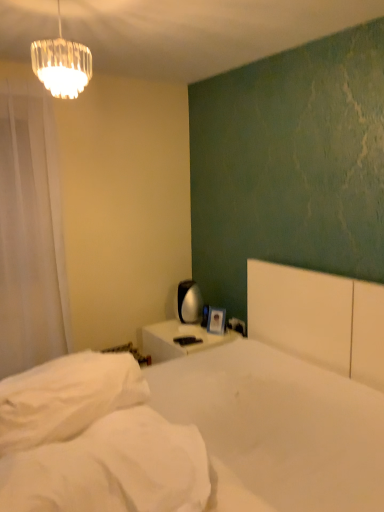
This screenshot has height=512, width=384. Describe the element at coordinates (179, 336) in the screenshot. I see `white glossy nightstand at center` at that location.

The width and height of the screenshot is (384, 512). I want to click on white plastic electric outlet at upper right, so click(x=237, y=326).

Identify the location of white matte bed at center. (190, 435).

Which object is closer to the camera taking this photo, white plastic electric outlet at upper right or white soft pillow at lower left?

Positioned in front is white soft pillow at lower left.

Consider the image. Considering the sizes of white plastic electric outlet at upper right and white soft pillow at lower left in the image, is white plastic electric outlet at upper right taller or shorter than white soft pillow at lower left?

In the image, white plastic electric outlet at upper right appears to be shorter than white soft pillow at lower left.

From a real-world perspective, is white plastic electric outlet at upper right physically located above or below white soft pillow at lower left?

In terms of real-world spatial position, white plastic electric outlet at upper right is below white soft pillow at lower left.

At what (x,y) coordinates should I click in order to perform the action: click on electric outlet that appears behind the white soft pillow at lower left. Please return your answer as a coordinate pair (x, y). Looking at the image, I should click on point(237,326).

Locate an element on the screen. mattress above the white glossy nightstand at center (from the image's perspective) is located at coordinates (94, 441).

Based on their sizes in the image, would you say white soft mattress at lower left is bigger or smaller than white glossy nightstand at center?

Considering their sizes, white soft mattress at lower left takes up less space than white glossy nightstand at center.

Between point (120, 404) and point (210, 343), which one is positioned in front?

Point (120, 404)

Considering the relative positions of white soft mattress at lower left and white glossy nightstand at center in the image provided, is white soft mattress at lower left to the left or to the right of white glossy nightstand at center?

Clearly, white soft mattress at lower left is on the left of white glossy nightstand at center in the image.

Is white sheer curtain at left oriented away from white matte bed at center?

No, white matte bed at center is not at the back of white sheer curtain at left.

Is white sheer curtain at left not near white matte bed at center?

Yes.

Consider the image. Is white sheer curtain at left surrounding white matte bed at center?

No.

Find the location of a particular element. This screenshot has width=384, height=512. curtain above the white matte bed at center (from a real-world perspective) is located at coordinates (30, 232).

The width and height of the screenshot is (384, 512). What are the coordinates of `lamp in front of the white sheer curtain at left` in the screenshot? It's located at [61, 64].

Relative to clear glass chandelier at upper left, is white sheer curtain at left in front or behind?

white sheer curtain at left is behind clear glass chandelier at upper left.

From a real-world perspective, who is located higher, white sheer curtain at left or clear glass chandelier at upper left?

clear glass chandelier at upper left, from a real-world perspective.

Consider the image. In terms of width, does white matte bed at center look wider or thinner when compared to white soft pillow at lower left?

white matte bed at center is wider than white soft pillow at lower left.

From the picture: Which object is further away from the camera, white matte bed at center or white soft pillow at lower left?

white soft pillow at lower left.

Can you confirm if white matte bed at center is smaller than white soft pillow at lower left?

Actually, white matte bed at center might be larger than white soft pillow at lower left.

Can you confirm if white matte bed at center is positioned to the right of white soft pillow at lower left?

Yes.

Considering the relative positions of white soft mattress at lower left and white soft pillow at lower left in the image provided, is white soft mattress at lower left in front of white soft pillow at lower left?

That is True.

Would you say white soft mattress at lower left is a long distance from white soft pillow at lower left?

white soft mattress at lower left is actually quite close to white soft pillow at lower left.

Which is behind, point (16, 376) or point (83, 422)?

The point (16, 376) is farther.

How many degrees apart are the facing directions of white soft mattress at lower left and white soft pillow at lower left?

The angular difference between white soft mattress at lower left and white soft pillow at lower left is 25.7 degrees.

In the scene shown: Is white sheer curtain at left taller than white glossy nightstand at center?

Yes, white sheer curtain at left is taller than white glossy nightstand at center.

From the picture: Is white sheer curtain at left next to white glossy nightstand at center?

No, white sheer curtain at left is not in contact with white glossy nightstand at center.

Is white sheer curtain at left positioned beyond the bounds of white glossy nightstand at center?

Yes, white sheer curtain at left is located beyond the bounds of white glossy nightstand at center.

Looking at this image, relative to white glossy nightstand at center, is white sheer curtain at left in front or behind?

Clearly, white sheer curtain at left is in front of white glossy nightstand at center.

Locate an element on the screen. The height and width of the screenshot is (512, 384). electric outlet behind the white soft pillow at lower left is located at coordinates (237, 326).

This screenshot has height=512, width=384. Identify the location of nightstand below the white soft mattress at lower left (from a real-world perspective). (179, 336).

When comparing their distances from white soft mattress at lower left, does white soft pillow at lower left or white plastic electric outlet at upper right seem closer?

white soft pillow at lower left.

Estimate the real-world distances between objects in this image. Which object is further from white soft pillow at lower left, white plastic electric outlet at upper right or white glossy nightstand at center?

white plastic electric outlet at upper right is further to white soft pillow at lower left.

Estimate the real-world distances between objects in this image. Which object is closer to white glossy nightstand at center, clear glass chandelier at upper left or white sheer curtain at left?

white sheer curtain at left is positioned closer to the anchor white glossy nightstand at center.

Looking at the image, which one is located closer to white matte bed at center, white sheer curtain at left or white soft pillow at lower left?

Based on the image, white soft pillow at lower left appears to be nearer to white matte bed at center.

Based on their spatial positions, is clear glass chandelier at upper left or white glossy nightstand at center closer to white sheer curtain at left?

Based on the image, white glossy nightstand at center appears to be nearer to white sheer curtain at left.

Considering their positions, is white glossy nightstand at center positioned closer to white soft mattress at lower left than white sheer curtain at left?

The object closer to white soft mattress at lower left is white glossy nightstand at center.

Which object lies further to the anchor point white sheer curtain at left, white plastic electric outlet at upper right or white glossy nightstand at center?

white plastic electric outlet at upper right is further to white sheer curtain at left.

From the image, which object appears to be nearer to white sheer curtain at left, white soft pillow at lower left or white glossy nightstand at center?

Among the two, white glossy nightstand at center is located nearer to white sheer curtain at left.

Identify the location of nightstand positioned between white soft mattress at lower left and white plastic electric outlet at upper right from near to far. point(179,336).

Locate an element on the screen. The image size is (384, 512). nightstand between white matte bed at center and white plastic electric outlet at upper right along the z-axis is located at coordinates (179, 336).

Find the location of a particular element. The width and height of the screenshot is (384, 512). nightstand located between white sheer curtain at left and white plastic electric outlet at upper right in the left-right direction is located at coordinates (179, 336).

Where is `lamp located between white soft mattress at lower left and white plastic electric outlet at upper right in the depth direction`? This screenshot has width=384, height=512. lamp located between white soft mattress at lower left and white plastic electric outlet at upper right in the depth direction is located at coordinates (61, 64).